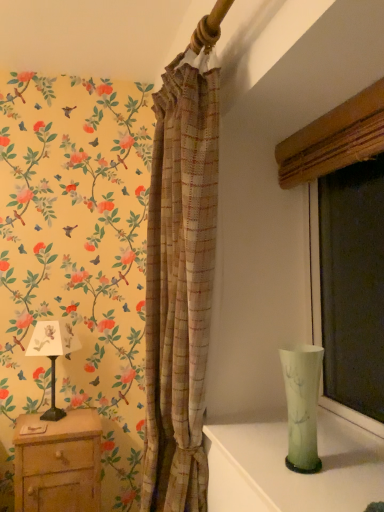
Identify the location of vacant area on top of green glass vase at lower right (from a real-world perspective). The image size is (384, 512). (298, 465).